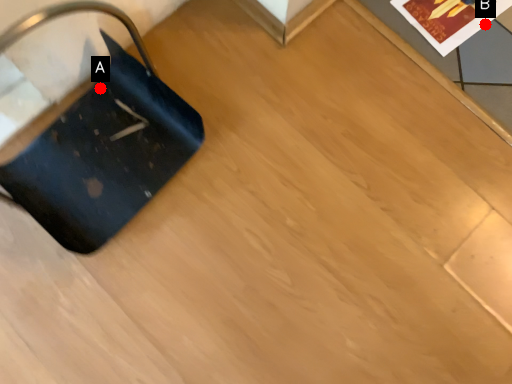
Question: Two points are circled on the image, labeled by A and B beside each circle. Which point is further to the camera?

Choices:
 (A) A is further
 (B) B is further

Answer: (B)